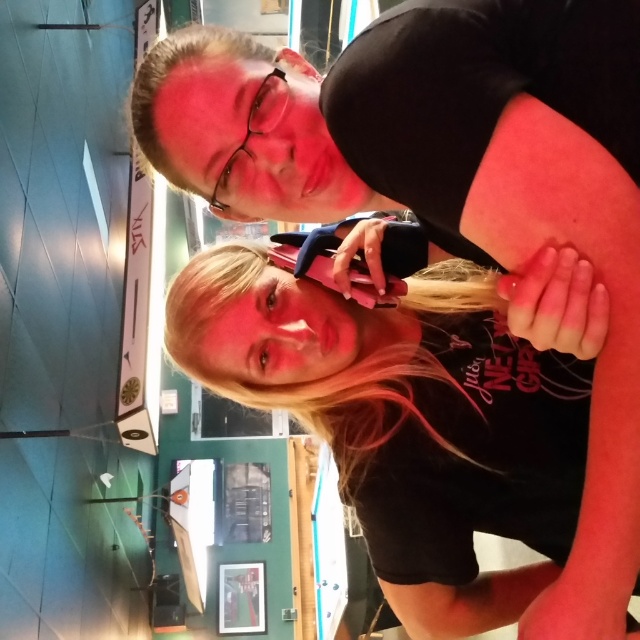
Question: Does black matte phone at center appear on the left side of blonde hair at upper center?

Choices:
 (A) yes
 (B) no

Answer: (B)

Question: Among these points, which one is nearest to the camera?

Choices:
 (A) (173, 168)
 (B) (285, 404)
 (C) (390, 424)

Answer: (A)

Question: Which of these objects is positioned farthest from the blonde hair at center?

Choices:
 (A) blonde hair at upper center
 (B) black matte phone at center

Answer: (A)

Question: Which of the following is the farthest from the observer?

Choices:
 (A) (305, 360)
 (B) (410, 356)

Answer: (B)

Question: Does black matte phone at center lie in front of blonde hair at center?

Choices:
 (A) no
 (B) yes

Answer: (B)

Question: Is black matte phone at center positioned before blonde hair at upper center?

Choices:
 (A) no
 (B) yes

Answer: (B)